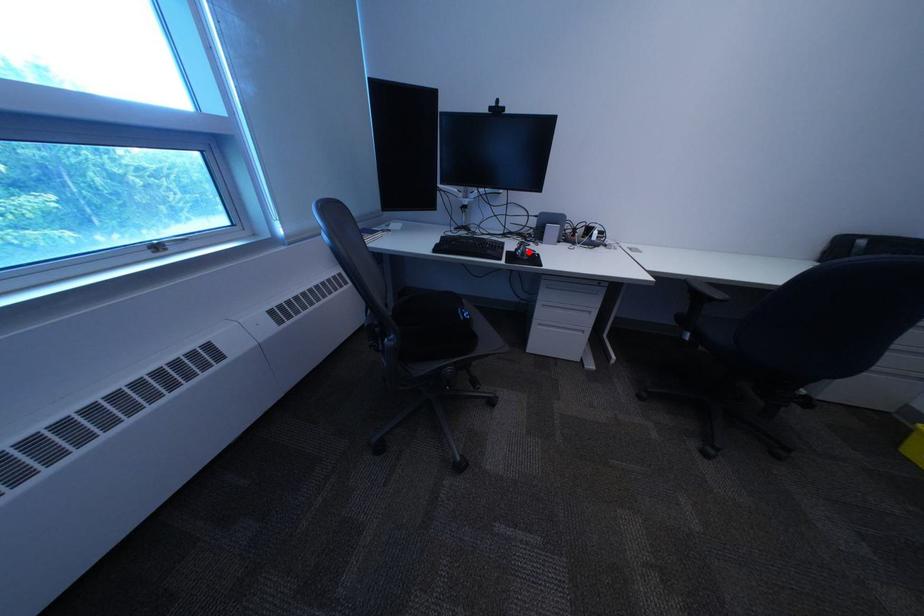
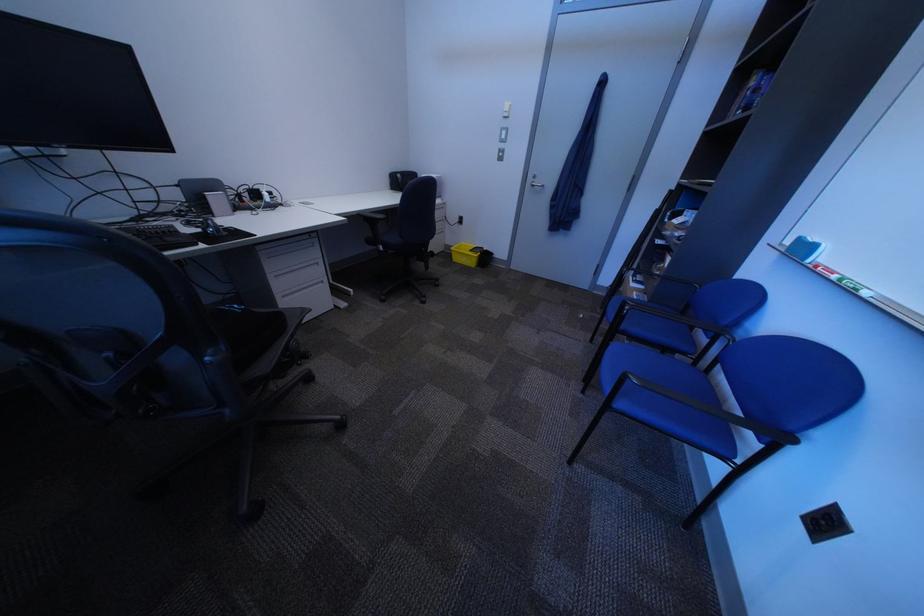
Where in the second image is the point corresponding to the highlighted location from the first image?

(214, 232)